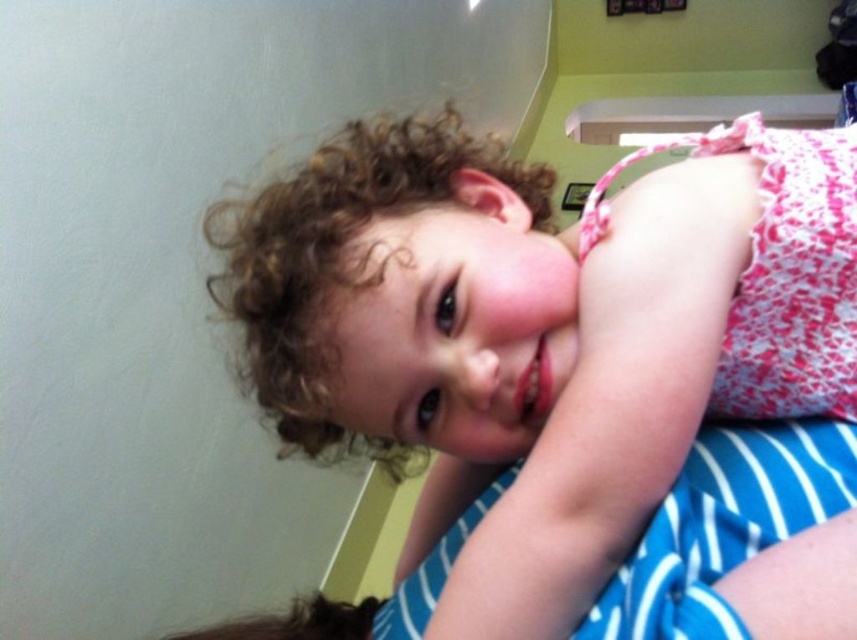
You are a photographer trying to capture a photo of the pink lace dress at center and the blue striped fabric at lower right. Which object should you focus on first if you want to include both in your frame without moving the camera?

The pink lace dress at center is positioned on the left side of blue striped fabric at lower right, so you should focus on the pink lace dress at center first to ensure both are in frame without moving the camera.

You are taking a photo of the scene and want to focus on both the point at coordinates point (742,257) and point (681,625). Since the camera can only focus on one plane at a time, which point should you prioritize focusing on to ensure the closest object is sharp?

You should prioritize focusing on point (742,257) because it is closer to the viewer than point (681,625), ensuring the closest object is in focus.

You are a photographer setting up for a family photo. You need to ensure that the pink lace dress at center and the blue striped fabric at lower right are visible in the frame. Given that the camera has a focal length of 50mm, what is the minimum distance you should keep between the camera and the subjects to capture both objects without distortion?

The pink lace dress at center is 10.27 centimeters from the blue striped fabric at lower right. To capture both objects without distortion using a 50mm lens, the minimum distance should be calculated using the formula distance > object separation divided by acceptable distortion ratio. Assuming a distortion ratio of 0.1, the minimum distance would be 10.27cm divided by 0.1 equals 102.7 centimeters. Thus, the photographer should position the camera at least 102.7 cm away from the subjects.